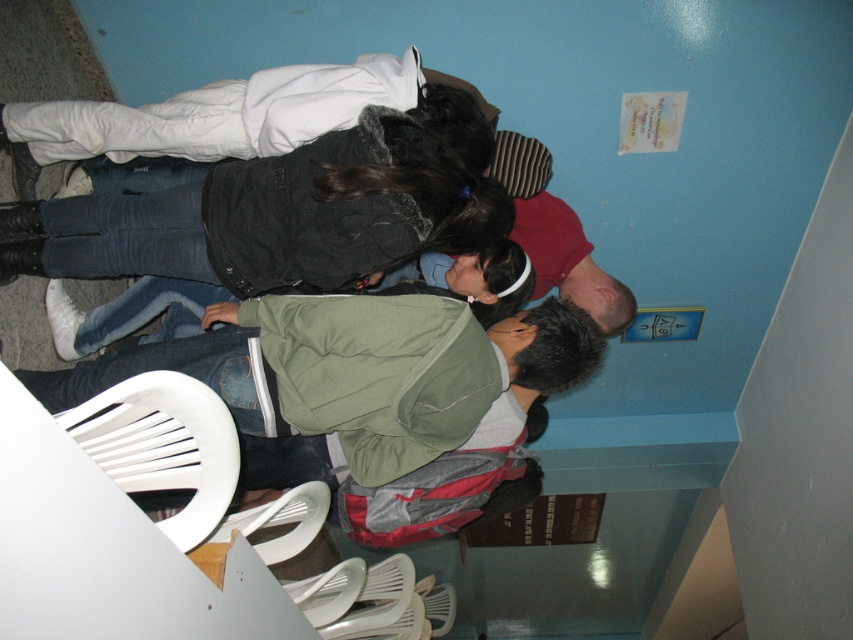
You are a person who is 1.7 meters tall. You are standing in the room and want to reach the small poster or notice on the wall near the top right corner. The denim jacket at center is blocking your view. Can you step around it to get a clear view of the poster?

The denim jacket at center is 1.45 meters away from you. Since it is blocking your view, you can step around it to get a clear view of the poster as long as there is enough space to move around the jacket.

You are organizing a small event in the room and need to place a new table between the denim jacket at center and the white plastic chair at lower left. Considering their sizes, which object should the table be placed closer to?

The table should be placed closer to the white plastic chair at lower left because the denim jacket at center is larger in size, so the chair is smaller and requires less space between them.

You are a person who wants to sit down on the white plastic chair at lower left. Is the denim jacket at center blocking your path to the chair?

The denim jacket at center is above the white plastic chair at lower left, so it is not blocking the path to the chair. You can sit down without moving the jacket.